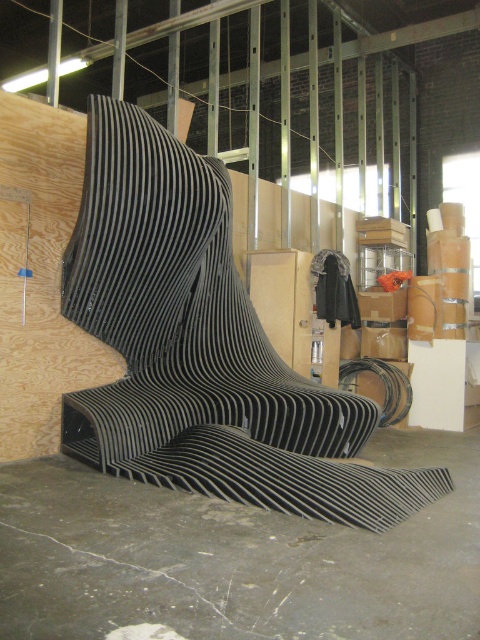
Can you confirm if black striped bench at center is smaller than matte cardboard box at center-right?

No, black striped bench at center is not smaller than matte cardboard box at center-right.

Locate an element on the screen. The image size is (480, 640). black striped bench at center is located at coordinates click(x=202, y=348).

Where is `black striped bench at center`? This screenshot has height=640, width=480. black striped bench at center is located at coordinates (x=202, y=348).